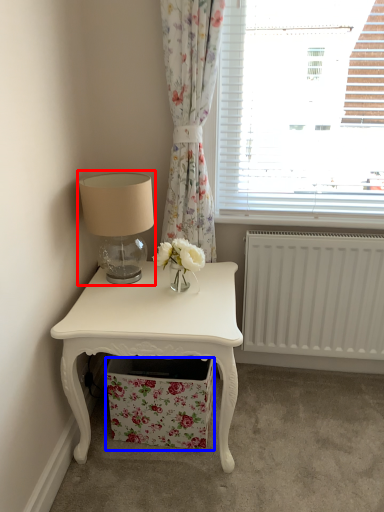
Question: Which object is closer to the camera taking this photo, table lamp (highlighted by a red box) or drawer (highlighted by a blue box)?

Choices:
 (A) table lamp
 (B) drawer

Answer: (A)